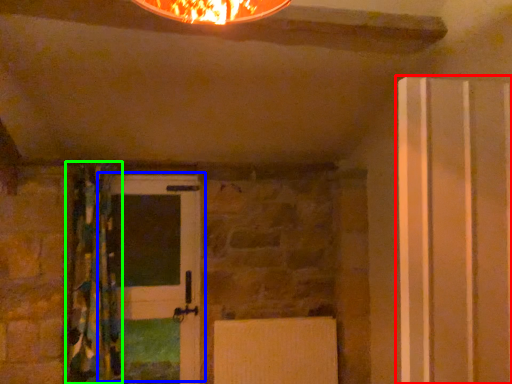
Question: Which object is positioned closest to door (highlighted by a red box)? Select from door (highlighted by a blue box) and curtain (highlighted by a green box).

Choices:
 (A) door
 (B) curtain

Answer: (A)